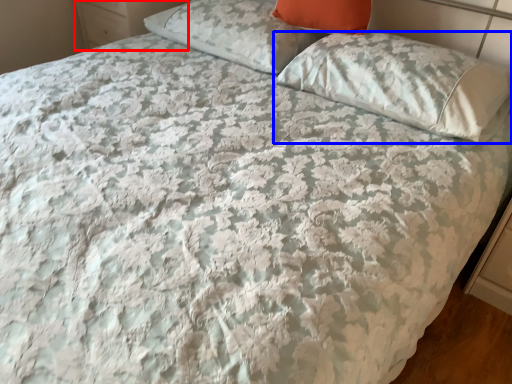
Question: Which object is closer to the camera taking this photo, dresser (highlighted by a red box) or pillow (highlighted by a blue box)?

Choices:
 (A) dresser
 (B) pillow

Answer: (B)